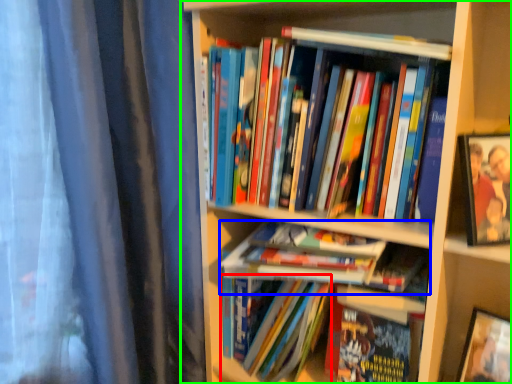
Question: Which object is the closest to the book (highlighted by a red box)? Choose among these: book (highlighted by a blue box) or bookcase (highlighted by a green box).

Choices:
 (A) book
 (B) bookcase

Answer: (A)